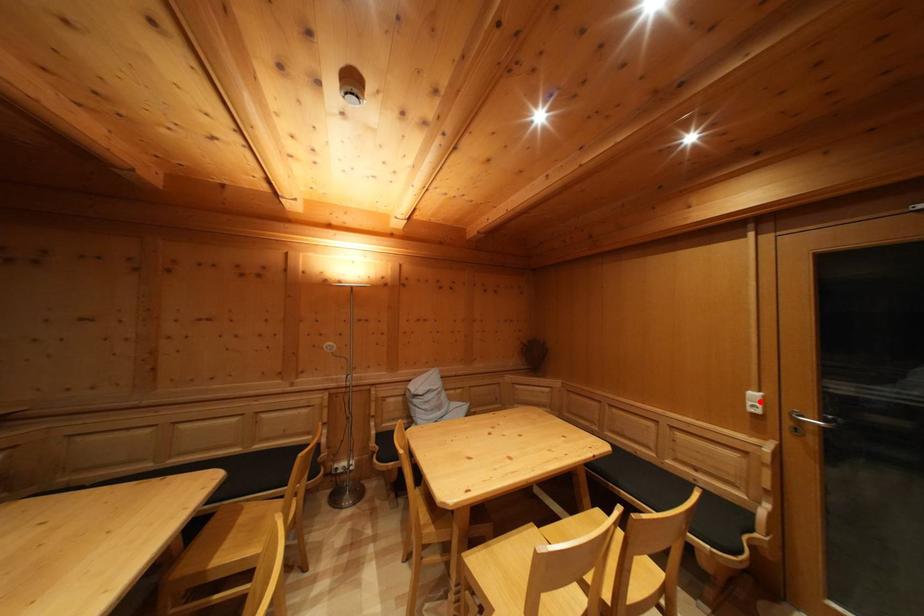
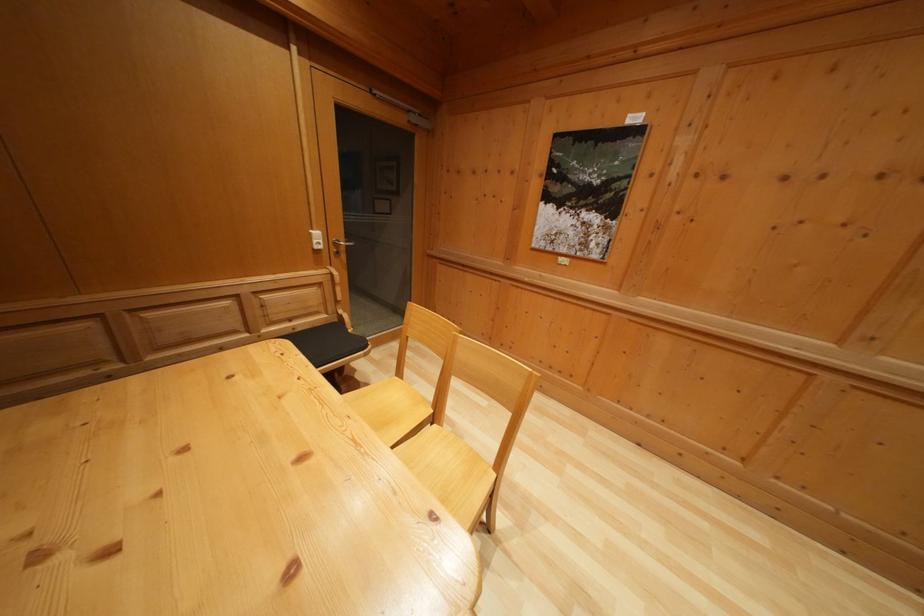
Question: I am providing you with two images of the same scene from different viewpoints. A red point is shown in image1. For the corresponding object point in image2, is it positioned nearer or farther from the camera?

Choices:
 (A) Nearer
 (B) Farther

Answer: (A)